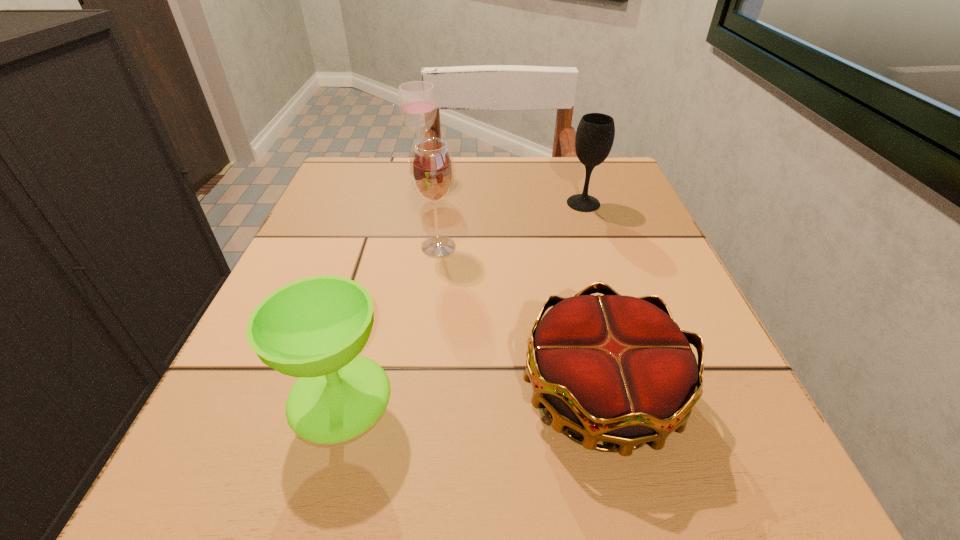
At what (x,y) coordinates should I click in order to perform the action: click on the farthest wineglass. Please return your answer as a coordinate pair (x, y). This screenshot has width=960, height=540. Looking at the image, I should click on (417, 100).

Identify the location of the second nearest wineglass. The width and height of the screenshot is (960, 540). (432, 170).

The height and width of the screenshot is (540, 960). In order to click on the second farthest object in this screenshot , I will do [x=595, y=133].

Identify the location of the third nearest wineglass. This screenshot has width=960, height=540. (595, 133).

Find the location of a particular element. The image size is (960, 540). the second shortest object is located at coordinates (314, 328).

What are the coordinates of `the shortest wineglass` in the screenshot? It's located at (314, 328).

The height and width of the screenshot is (540, 960). Identify the location of the shortest object. (615, 368).

Locate an element on the screen. Image resolution: width=960 pixels, height=540 pixels. free space located 0.210m on the front of the farthest object is located at coordinates 412,242.

Find the location of a particular element. The image size is (960, 540). vacant area situated 0.320m on the front of the third farthest object is located at coordinates (418, 426).

Find the location of a particular element. free spot located 0.320m on the left of the fourth nearest object is located at coordinates (412, 204).